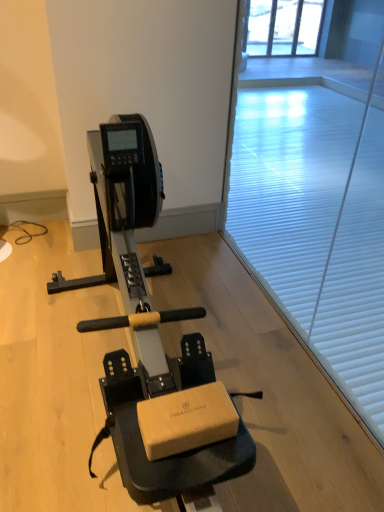
The image size is (384, 512). Identify the location of vacant space underneath white matte window screen at center (from a real-world perspective). (296, 316).